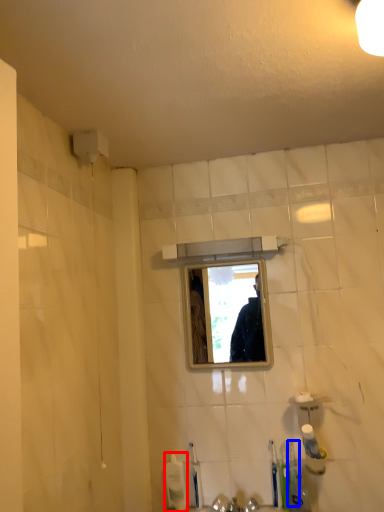
Question: Among these objects, which one is nearest to the camera, toiletry (highlighted by a red box) or toothbrush (highlighted by a blue box)?

Choices:
 (A) toiletry
 (B) toothbrush

Answer: (B)